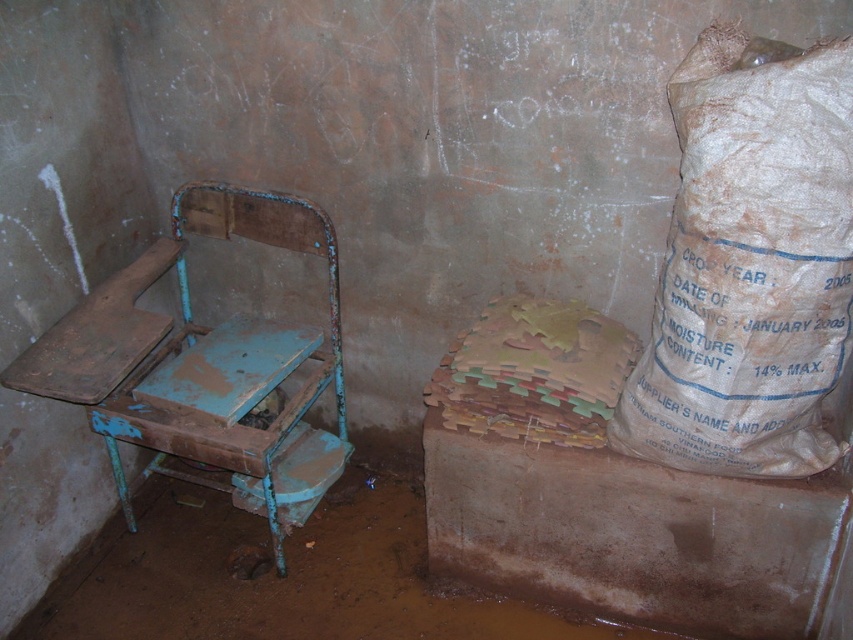
Between brown paper sack at upper right and rusty metal chair at left, which one has less height?

With less height is brown paper sack at upper right.

Which is in front, point (654, 307) or point (93, 371)?

Point (654, 307) is more forward.

Locate an element on the screen. Image resolution: width=853 pixels, height=640 pixels. brown paper sack at upper right is located at coordinates (749, 268).